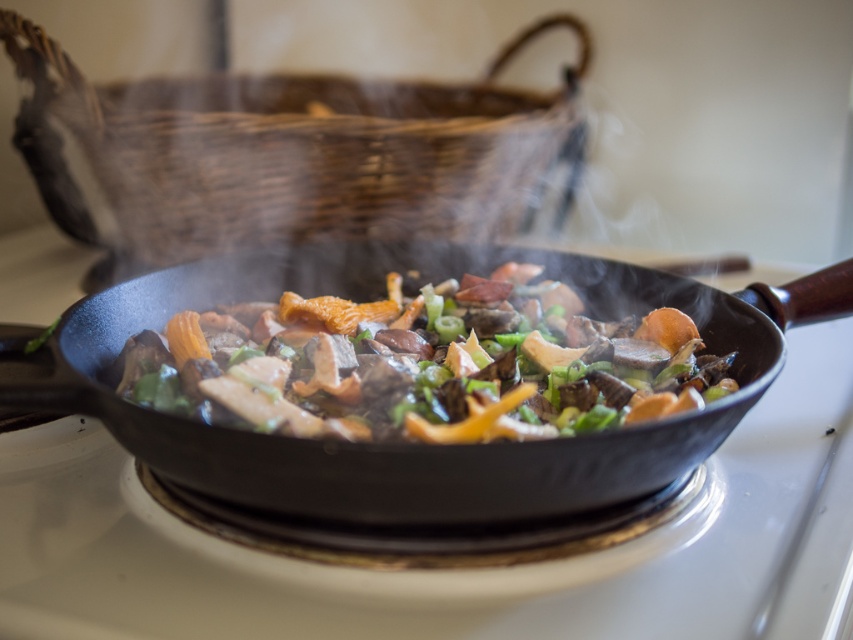
Question: Is woven brown basket at upper center bigger than shiny brown pan at center?

Choices:
 (A) no
 (B) yes

Answer: (B)

Question: Is shiny black pan at center bigger than shiny brown pan at center?

Choices:
 (A) no
 (B) yes

Answer: (B)

Question: Which object is closer to the camera taking this photo?

Choices:
 (A) woven brown basket at upper center
 (B) shiny brown pan at center
 (C) shiny black pan at center

Answer: (C)

Question: Which of these objects is positioned farthest from the shiny black pan at center?

Choices:
 (A) woven brown basket at upper center
 (B) shiny brown pan at center

Answer: (A)

Question: Does woven brown basket at upper center come in front of shiny black pan at center?

Choices:
 (A) yes
 (B) no

Answer: (B)

Question: Considering the real-world distances, which object is closest to the shiny brown pan at center?

Choices:
 (A) woven brown basket at upper center
 (B) shiny black pan at center

Answer: (B)